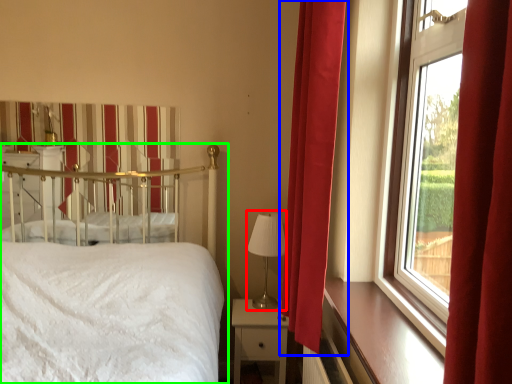
Question: Which is farther away from table lamp (highlighted by a red box)? curtain (highlighted by a blue box) or bed (highlighted by a green box)?

Choices:
 (A) curtain
 (B) bed

Answer: (B)